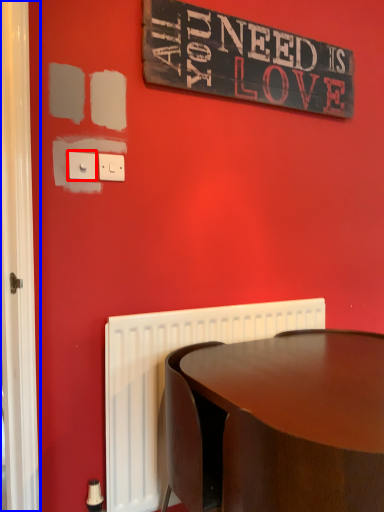
Question: Which object is closer to the camera taking this photo, electric outlet (highlighted by a red box) or screen door (highlighted by a blue box)?

Choices:
 (A) electric outlet
 (B) screen door

Answer: (B)